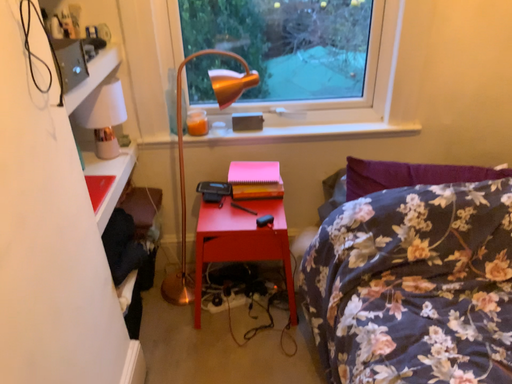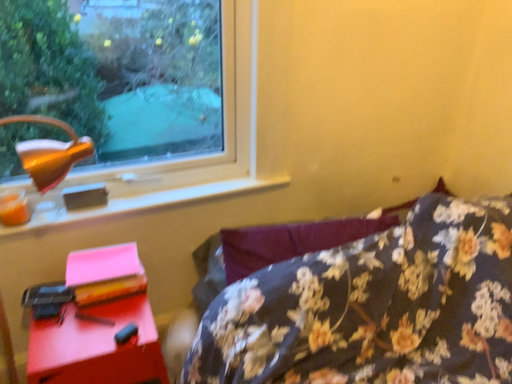
Question: How did the camera likely rotate when shooting the video?

Choices:
 (A) rotated left
 (B) rotated right

Answer: (B)